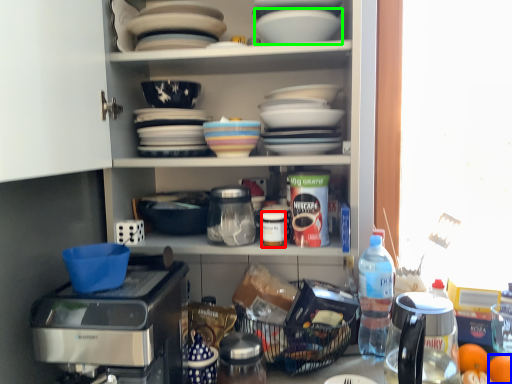
Question: Based on their relative distances, which object is nearer to bottle (highlighted by a red box)? Choose from tangerine (highlighted by a blue box) and tableware (highlighted by a green box).

Choices:
 (A) tangerine
 (B) tableware

Answer: (B)